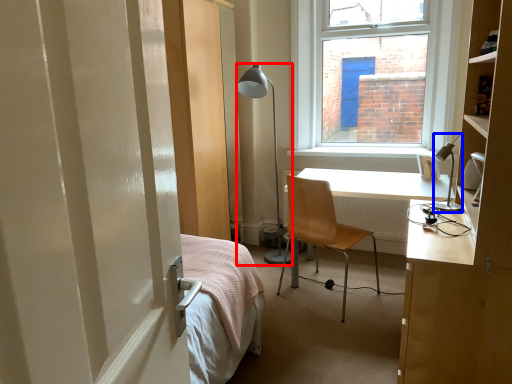
Question: Among these objects, which one is farthest to the camera, lamp (highlighted by a red box) or lamp (highlighted by a blue box)?

Choices:
 (A) lamp
 (B) lamp

Answer: (A)